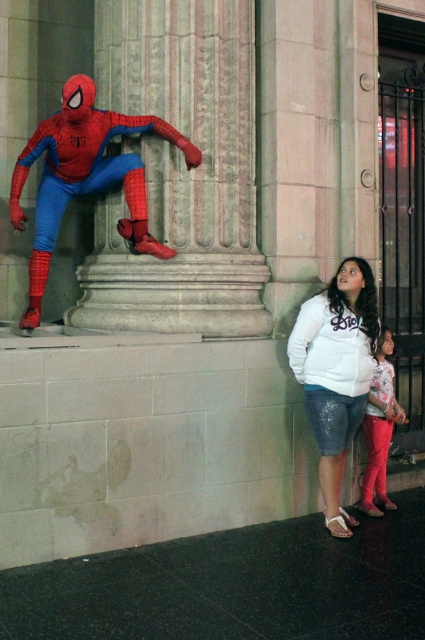
Question: Does shiny spandex suit at center have a lesser width compared to glittery leggings at lower right?

Choices:
 (A) no
 (B) yes

Answer: (A)

Question: Observing the image, what is the correct spatial positioning of shiny spandex suit at center in reference to glittery leggings at lower right?

Choices:
 (A) above
 (B) below

Answer: (A)

Question: Which of the following is the farthest from the observer?

Choices:
 (A) white sequined shorts at lower right
 (B) glittery leggings at lower right

Answer: (B)

Question: Among these objects, which one is farthest from the camera?

Choices:
 (A) shiny spandex suit at center
 (B) white sequined shorts at lower right
 (C) glittery leggings at lower right

Answer: (C)

Question: Based on their relative distances, which object is nearer to the glittery leggings at lower right?

Choices:
 (A) shiny spandex suit at center
 (B) white sequined shorts at lower right

Answer: (B)

Question: Does white sequined shorts at lower right have a greater width compared to glittery leggings at lower right?

Choices:
 (A) no
 (B) yes

Answer: (B)